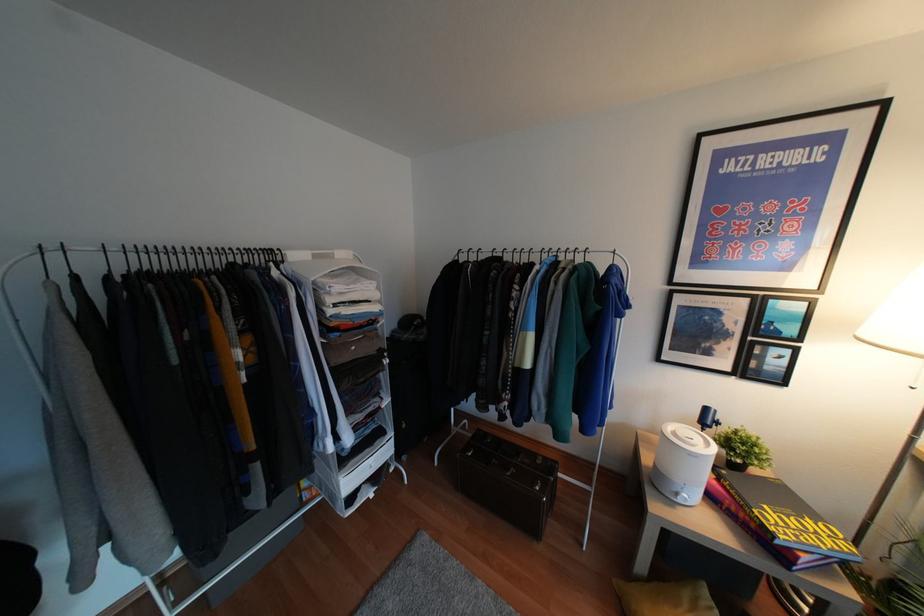
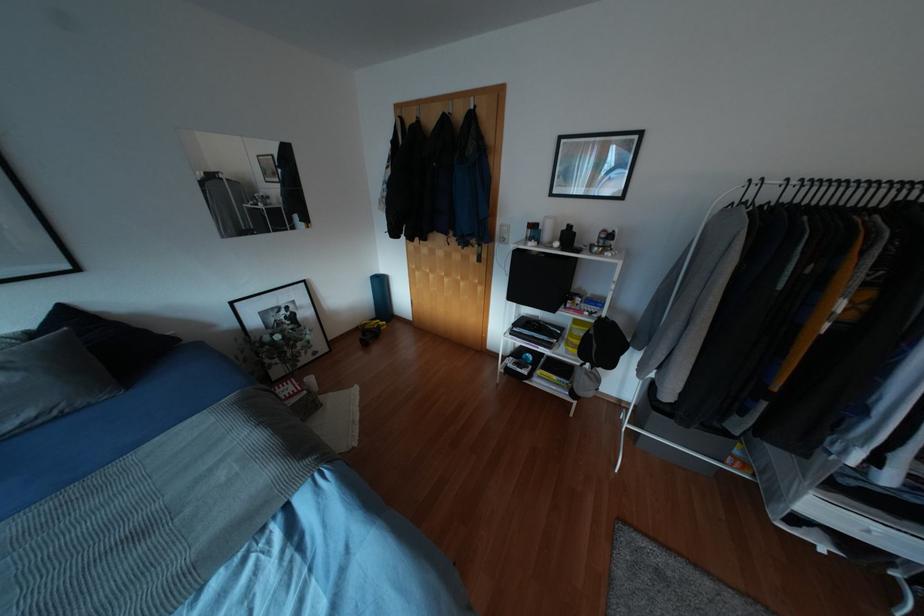
Based on the continuous images, in which direction is the camera rotating?

The rotation direction of the camera is left-down.